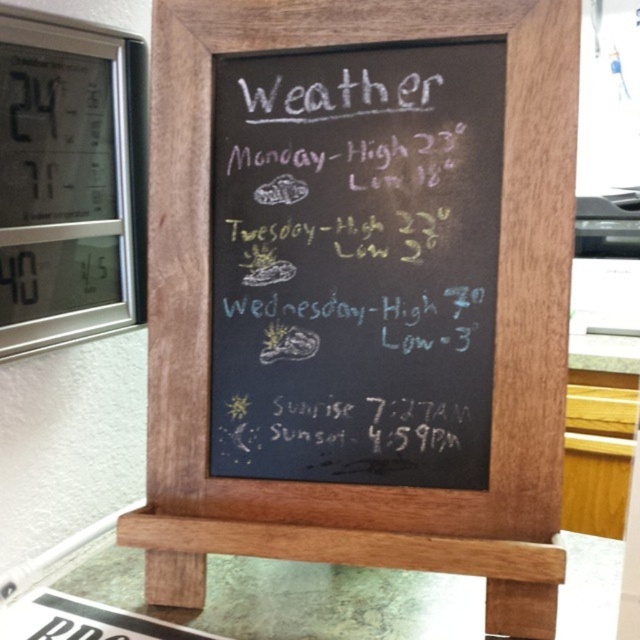
Is white chalkboard at center to the right of brown wood stool at center from the viewer's perspective?

Indeed, white chalkboard at center is positioned on the right side of brown wood stool at center.

You are a GUI agent. You are given a task and a screenshot of the screen. Output one action in this format:
    pyautogui.click(x=<x>, y=<y>)
    Task: Click on the white chalkboard at center
    
    Given the screenshot: What is the action you would take?
    pyautogui.click(x=358, y=291)

Identify the location of silver digital clock at upper left. (68, 180).

Based on the photo, is silver digital clock at upper left above brown wood stool at center?

Indeed, silver digital clock at upper left is positioned over brown wood stool at center.

Measure the distance between point (109, 131) and camera.

Point (109, 131) is 29.80 inches from camera.

Locate an element on the screen. Image resolution: width=640 pixels, height=640 pixels. silver digital clock at upper left is located at coordinates (68, 180).

Between point (486, 396) and point (138, 51), which one is positioned in front?

Point (486, 396) is more forward.

Which is more to the right, white paperboard menu at center or silver digital clock at upper left?

white paperboard menu at center is more to the right.

Measure the distance between white paperboard menu at center and camera.

white paperboard menu at center and camera are 23.76 inches apart.

At what (x,y) coordinates should I click in order to perform the action: click on white paperboard menu at center. Please return your answer as a coordinate pair (x, y). The width and height of the screenshot is (640, 640). Looking at the image, I should click on (355, 262).